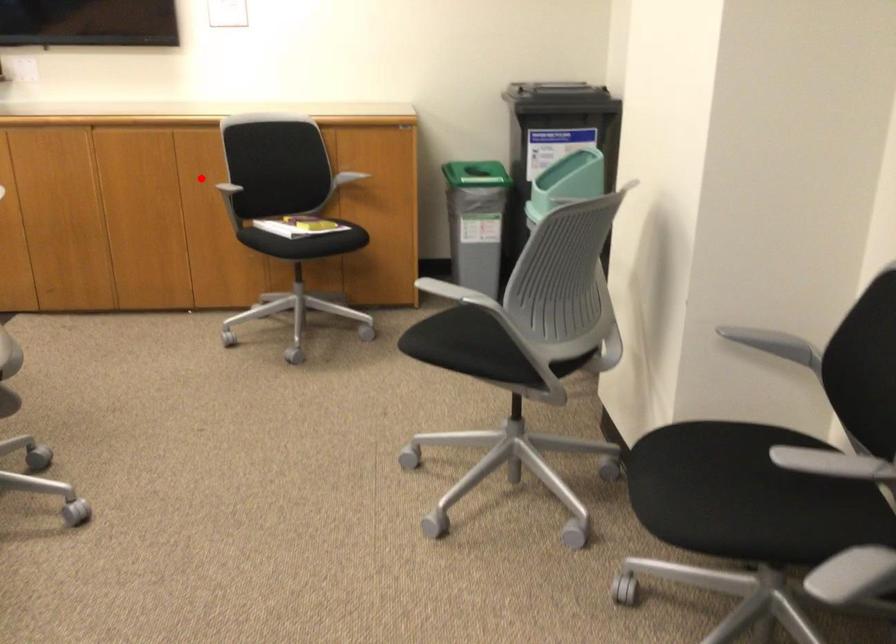
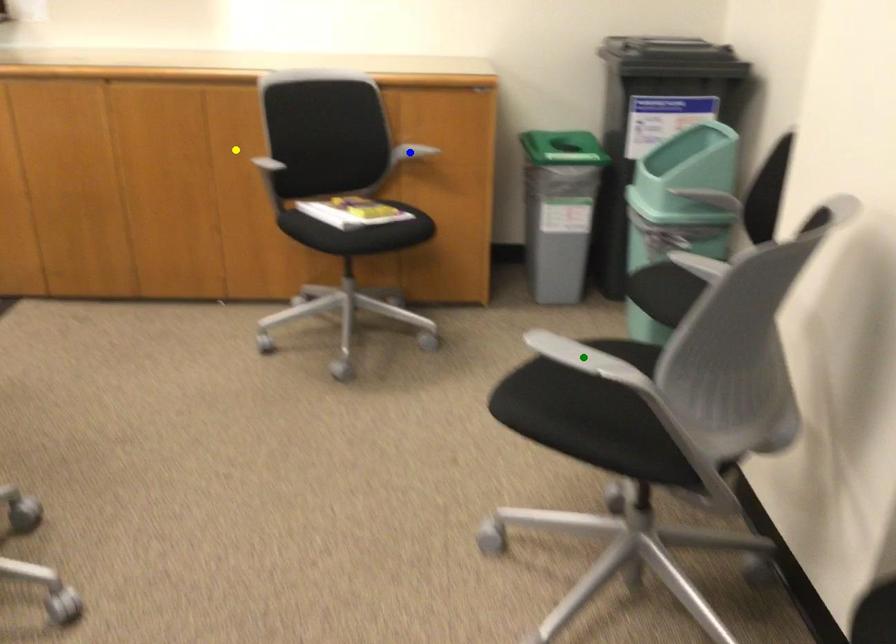
Question: I am providing you with two images of the same scene from different viewpoints. A red point is marked on the first image. You are given multiple points on the second image. In image 2, which mark is for the same physical point as the one in image 1?

Choices:
 (A) yellow point
 (B) green point
 (C) blue point

Answer: (A)